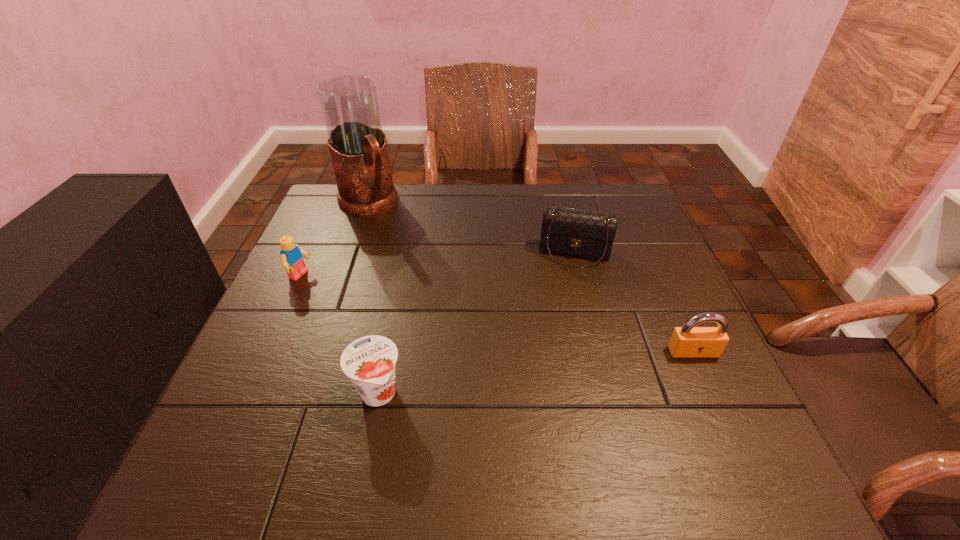
Where is `object at the near edge`? This screenshot has height=540, width=960. object at the near edge is located at coordinates (369, 361).

I want to click on pitcher at the left edge, so click(357, 144).

Locate an element on the screen. This screenshot has height=540, width=960. Lego that is at the left edge is located at coordinates (291, 259).

The width and height of the screenshot is (960, 540). I want to click on padlock that is at the right edge, so 688,341.

Find the location of a particular element. The image size is (960, 540). clutch bag at the right edge is located at coordinates (581, 233).

This screenshot has width=960, height=540. Find the location of `object that is at the far left corner`. object that is at the far left corner is located at coordinates (357, 144).

Find the location of a particular element. This screenshot has width=960, height=540. vacant region at the far edge of the desktop is located at coordinates (450, 206).

Find the location of a particular element. This screenshot has height=540, width=960. free space at the near edge of the desktop is located at coordinates point(449,403).

At what (x,y) coordinates should I click in order to perform the action: click on vacant region at the left edge. Please return your answer as a coordinate pair (x, y). The height and width of the screenshot is (540, 960). Looking at the image, I should click on (348, 232).

In the image, there is a desktop. Identify the location of vacant space at the right edge. (x=667, y=321).